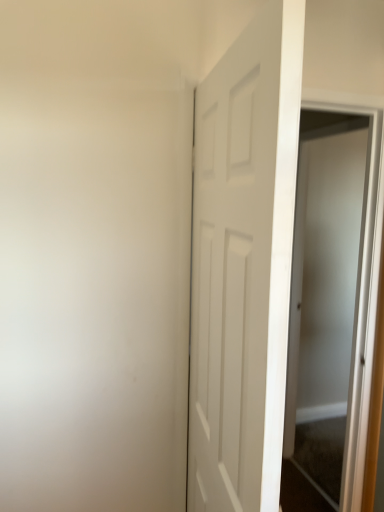
Question: Considering the relative positions of clear glass screen door at right and white matte door at center in the image provided, is clear glass screen door at right to the left of white matte door at center from the viewer's perspective?

Choices:
 (A) yes
 (B) no

Answer: (B)

Question: Is clear glass screen door at right located outside white matte door at center?

Choices:
 (A) yes
 (B) no

Answer: (A)

Question: Considering the relative positions of clear glass screen door at right and white matte door at center in the image provided, is clear glass screen door at right behind white matte door at center?

Choices:
 (A) yes
 (B) no

Answer: (A)

Question: Can you confirm if clear glass screen door at right is bigger than white matte door at center?

Choices:
 (A) yes
 (B) no

Answer: (B)

Question: Is white matte door at center a part of clear glass screen door at right?

Choices:
 (A) yes
 (B) no

Answer: (B)

Question: From a real-world perspective, is clear glass screen door at right beneath white matte door at center?

Choices:
 (A) no
 (B) yes

Answer: (B)

Question: Does white matte door at center appear on the right side of clear glass screen door at right?

Choices:
 (A) no
 (B) yes

Answer: (A)

Question: Is white matte door at center positioned before clear glass screen door at right?

Choices:
 (A) no
 (B) yes

Answer: (B)

Question: From the image's perspective, is white matte door at center located beneath clear glass screen door at right?

Choices:
 (A) yes
 (B) no

Answer: (B)

Question: Can you confirm if white matte door at center is wider than clear glass screen door at right?

Choices:
 (A) no
 (B) yes

Answer: (B)

Question: Is white matte door at center next to clear glass screen door at right and touching it?

Choices:
 (A) yes
 (B) no

Answer: (B)

Question: From a real-world perspective, is white matte door at center located beneath clear glass screen door at right?

Choices:
 (A) yes
 (B) no

Answer: (B)

Question: Is point (324, 354) positioned closer to the camera than point (261, 481)?

Choices:
 (A) closer
 (B) farther

Answer: (B)